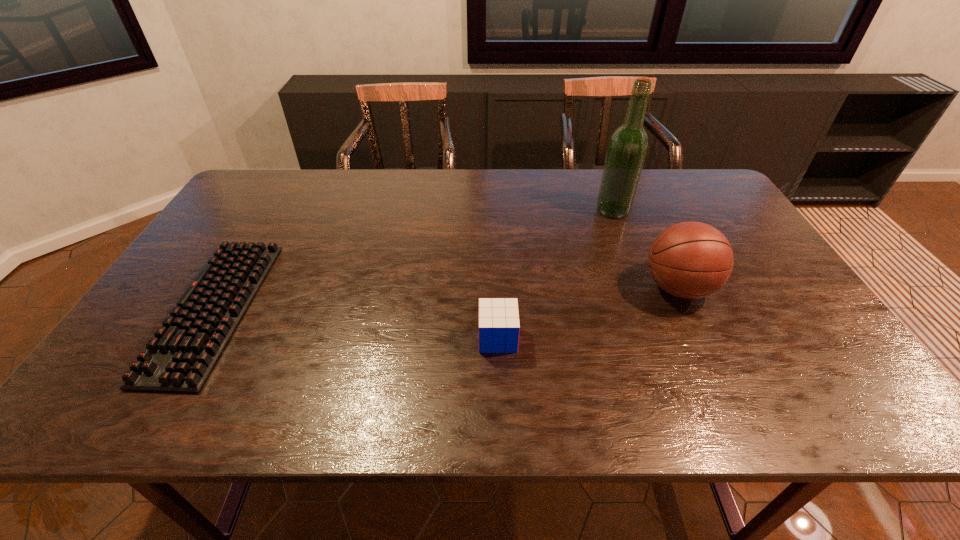
What are the coordinates of `object that stands as the third closest to the tallest object` in the screenshot? It's located at pyautogui.click(x=180, y=358).

Locate which object is the second closest to the second shortest object. Please provide its 2D coordinates. Your answer should be formatted as a tuple, i.e. [(x, y)], where the tuple contains the x and y coordinates of a point satisfying the conditions above.

[(628, 145)]

Locate an element on the screen. The image size is (960, 540). free space that satisfies the following two spatial constraints: 1. on the back side of the farthest object; 2. on the left side of the second object from left to right is located at coordinates (492, 210).

I want to click on free location that satisfies the following two spatial constraints: 1. on the back side of the leftmost object; 2. on the right side of the second tallest object, so click(227, 288).